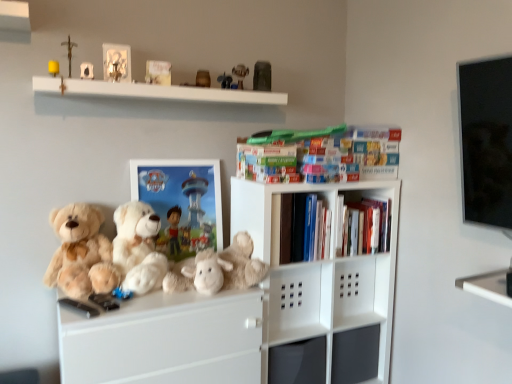
This screenshot has height=384, width=512. Identify the location of free space above matte plastic picture frame at center (from a real-world perspective). (182, 154).